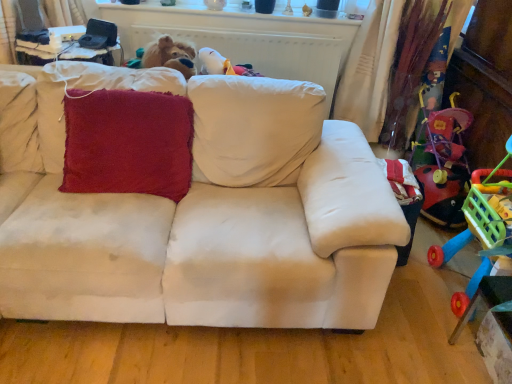
Measure the distance between velvety red cushion at center and camera.

velvety red cushion at center is 1.67 meters from camera.

The width and height of the screenshot is (512, 384). What do you see at coordinates (199, 213) in the screenshot?
I see `beige fabric couch at center` at bounding box center [199, 213].

What are the coordinates of `velvety red cushion at center` in the screenshot? It's located at (127, 143).

Looking at this image, does velvety red cushion at center have a smaller size compared to rubberized plastic shopping cart at right?

Yes.

Is rubberized plastic shopping cart at right completely or partially inside velvety red cushion at center?

That's incorrect, rubberized plastic shopping cart at right is not inside velvety red cushion at center.

From the image's perspective, would you say velvety red cushion at center is positioned over rubberized plastic shopping cart at right?

Yes, from the image's perspective, velvety red cushion at center is above rubberized plastic shopping cart at right.

Considering the sizes of objects beige fabric couch at center and rubberized plastic shopping cart at right in the image provided, who is bigger, beige fabric couch at center or rubberized plastic shopping cart at right?

beige fabric couch at center is bigger.

In order to click on toy located in front of the beige fabric couch at center in this screenshot , I will do `click(483, 222)`.

Considering the relative positions of beige fabric couch at center and rubberized plastic shopping cart at right in the image provided, is beige fabric couch at center in front of rubberized plastic shopping cart at right?

No, beige fabric couch at center is behind rubberized plastic shopping cart at right.

From a real-world perspective, is beige fabric couch at center physically located above or below rubberized plastic shopping cart at right?

beige fabric couch at center is situated lower than rubberized plastic shopping cart at right in the real world.

Who is bigger, rubberized plastic shopping cart at right or beige fabric couch at center?

Bigger between the two is beige fabric couch at center.

Could you tell me if rubberized plastic shopping cart at right is turned towards beige fabric couch at center?

Yes.

Can you tell me how much rubberized plastic shopping cart at right and beige fabric couch at center differ in facing direction?

rubberized plastic shopping cart at right and beige fabric couch at center are facing 89.1 degrees away from each other.

Which object is closer to the camera, rubberized plastic shopping cart at right or beige fabric couch at center?

rubberized plastic shopping cart at right is closer to the camera.

Which object is thinner, beige fabric couch at center or velvety red cushion at center?

With smaller width is velvety red cushion at center.

From a real-world perspective, which is physically below, beige fabric couch at center or velvety red cushion at center?

beige fabric couch at center, from a real-world perspective.

How different are the orientations of beige fabric couch at center and velvety red cushion at center in degrees?

There is a 0.000335-degree angle between the facing directions of beige fabric couch at center and velvety red cushion at center.

Find the location of a particular element. The image size is (512, 384). throw pillow located above the rubberized plastic shopping cart at right (from the image's perspective) is located at coordinates (127, 143).

From a real-world perspective, is rubberized plastic shopping cart at right above or below velvety red cushion at center?

rubberized plastic shopping cart at right is situated higher than velvety red cushion at center in the real world.

Does rubberized plastic shopping cart at right touch velvety red cushion at center?

They are not placed beside each other.

Considering the sizes of objects velvety red cushion at center and beige fabric couch at center in the image provided, who is bigger, velvety red cushion at center or beige fabric couch at center?

beige fabric couch at center.

From the image's perspective, between velvety red cushion at center and beige fabric couch at center, which one is located above?

From the image's view, velvety red cushion at center is above.

Considering the relative sizes of velvety red cushion at center and beige fabric couch at center in the image provided, is velvety red cushion at center shorter than beige fabric couch at center?

Yes, velvety red cushion at center is shorter than beige fabric couch at center.

From a real-world perspective, between velvety red cushion at center and beige fabric couch at center, who is vertically higher?

In real-world perspective, velvety red cushion at center is above.

Image resolution: width=512 pixels, height=384 pixels. What are the coordinates of `throw pillow on the left side of rubberized plastic shopping cart at right` in the screenshot? It's located at [x=127, y=143].

This screenshot has width=512, height=384. What are the coordinates of `toy above the beige fabric couch at center (from a real-world perspective)` in the screenshot? It's located at 483,222.

Considering their positions, is beige fabric couch at center positioned closer to velvety red cushion at center than rubberized plastic shopping cart at right?

The object closer to velvety red cushion at center is beige fabric couch at center.

Considering their positions, is velvety red cushion at center positioned further to beige fabric couch at center than rubberized plastic shopping cart at right?

rubberized plastic shopping cart at right is positioned further to the anchor beige fabric couch at center.

Based on the photo, from the image, which object appears to be farther from rubberized plastic shopping cart at right, velvety red cushion at center or beige fabric couch at center?

velvety red cushion at center.

When comparing their distances from rubberized plastic shopping cart at right, does beige fabric couch at center or velvety red cushion at center seem closer?

Among the two, beige fabric couch at center is located nearer to rubberized plastic shopping cart at right.

In the scene shown: Considering their positions, is rubberized plastic shopping cart at right positioned further to beige fabric couch at center than velvety red cushion at center?

rubberized plastic shopping cart at right.

Consider the image. Estimate the real-world distances between objects in this image. Which object is further from velvety red cushion at center, rubberized plastic shopping cart at right or beige fabric couch at center?

rubberized plastic shopping cart at right is positioned further to the anchor velvety red cushion at center.

Where is `studio couch situated between velvety red cushion at center and rubberized plastic shopping cart at right from left to right`? studio couch situated between velvety red cushion at center and rubberized plastic shopping cart at right from left to right is located at coordinates (199, 213).